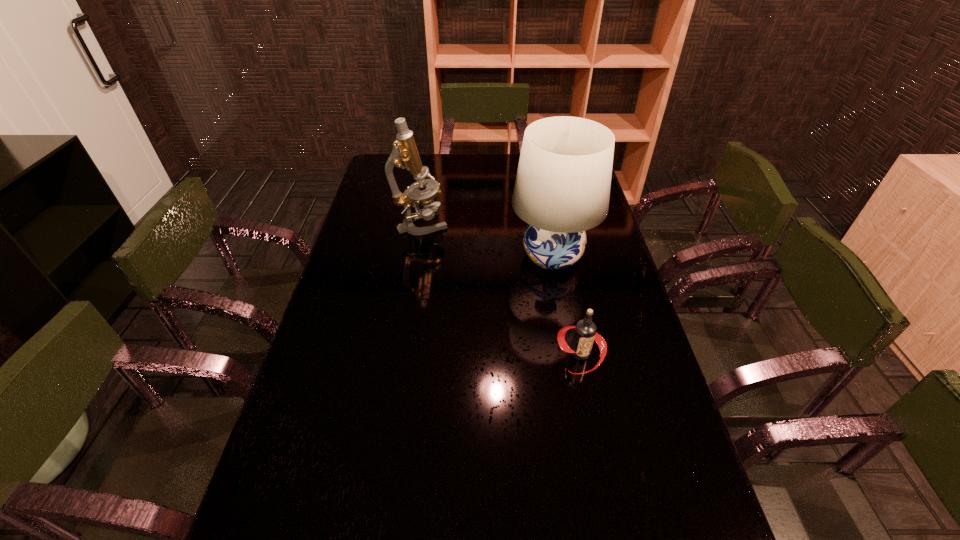
Locate an element on the screen. The image size is (960, 540). lampshade is located at coordinates (562, 188).

Find the location of a particular element. The height and width of the screenshot is (540, 960). microscope is located at coordinates (405, 155).

The image size is (960, 540). What are the coordinates of `the nearest object` in the screenshot? It's located at (585, 333).

Identify the location of the shortest object. (585, 333).

The height and width of the screenshot is (540, 960). In order to click on free space located 0.050m on the front-facing side of the lampshade in this screenshot , I will do `click(494, 256)`.

At what (x,y) coordinates should I click in order to perform the action: click on vacant position located on the front-facing side of the lampshade. Please return your answer as a coordinate pair (x, y). Image resolution: width=960 pixels, height=540 pixels. Looking at the image, I should click on (423, 256).

The image size is (960, 540). Find the location of `free space located on the front-facing side of the lampshade`. free space located on the front-facing side of the lampshade is located at coordinates (408, 256).

The width and height of the screenshot is (960, 540). What are the coordinates of `free location located 0.150m on the front of the microscope` in the screenshot? It's located at (415, 266).

What are the coordinates of `free space located 0.130m on the label of the nearest object` in the screenshot? It's located at [594, 423].

The height and width of the screenshot is (540, 960). Identify the location of object present at the left edge. (405, 155).